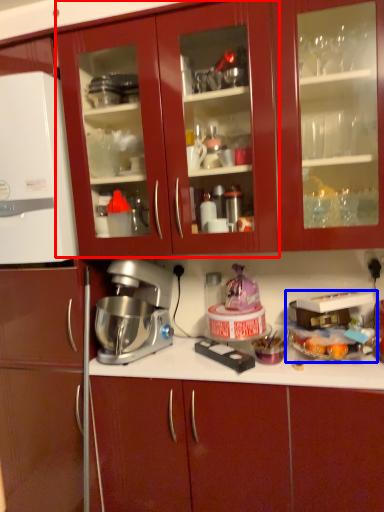
Question: Which object appears closest to the camera in this image, cabinetry (highlighted by a red box) or appliance (highlighted by a blue box)?

Choices:
 (A) cabinetry
 (B) appliance

Answer: (A)